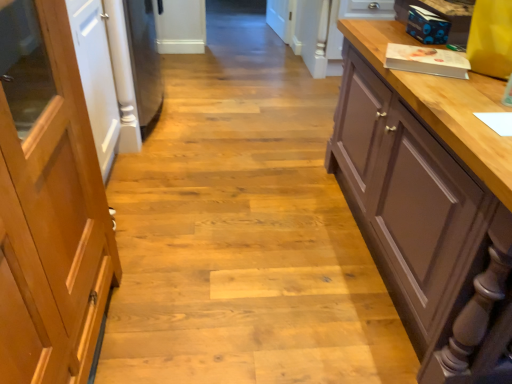
Where is `brown matte cupboard at right`? The height and width of the screenshot is (384, 512). brown matte cupboard at right is located at coordinates (425, 192).

What do you see at coordinates (425, 192) in the screenshot? The image size is (512, 384). I see `brown matte cupboard at right` at bounding box center [425, 192].

What do you see at coordinates (48, 203) in the screenshot? The height and width of the screenshot is (384, 512). I see `light brown wood door at left` at bounding box center [48, 203].

Locate an element on the screen. light brown wood door at left is located at coordinates (48, 203).

Locate an element on the screen. The image size is (512, 384). brown matte cupboard at right is located at coordinates (425, 192).

Based on the photo, is light brown wood door at left at the left side of brown matte cupboard at right?

Correct, you'll find light brown wood door at left to the left of brown matte cupboard at right.

Who is more distant, light brown wood door at left or brown matte cupboard at right?

brown matte cupboard at right is further away from the camera.

Is point (45, 163) more distant than point (454, 259)?

No.

From the picture: From the image's perspective, is light brown wood door at left above brown matte cupboard at right?

Incorrect, from the image's perspective, light brown wood door at left is lower than brown matte cupboard at right.

From a real-world perspective, is light brown wood door at left located beneath brown matte cupboard at right?

No, from a real-world perspective, light brown wood door at left is not beneath brown matte cupboard at right.

Can you confirm if light brown wood door at left is thinner than brown matte cupboard at right?

Yes, light brown wood door at left is thinner than brown matte cupboard at right.

In terms of height, does light brown wood door at left look taller or shorter compared to brown matte cupboard at right?

Considering their sizes, light brown wood door at left has more height than brown matte cupboard at right.

Between light brown wood door at left and brown matte cupboard at right, which one has smaller size?

Smaller between the two is light brown wood door at left.

Which is correct: light brown wood door at left is inside brown matte cupboard at right, or outside of it?

light brown wood door at left is not enclosed by brown matte cupboard at right.

Looking at this image, is light brown wood door at left placed right next to brown matte cupboard at right?

No, light brown wood door at left is not with brown matte cupboard at right.

Is light brown wood door at left facing towards brown matte cupboard at right?

Yes, light brown wood door at left is aimed at brown matte cupboard at right.

At what (x,y) coordinates should I click in order to perform the action: click on cabinetry positioned vertically above the brown matte cupboard at right (from a real-world perspective). Please return your answer as a coordinate pair (x, y). This screenshot has height=384, width=512. Looking at the image, I should click on (48, 203).

Can you confirm if brown matte cupboard at right is positioned to the right of light brown wood door at left?

Yes, brown matte cupboard at right is to the right of light brown wood door at left.

Which object is closer to the camera taking this photo, brown matte cupboard at right or light brown wood door at left?

Positioned in front is light brown wood door at left.

Between point (432, 115) and point (2, 66), which one is positioned behind?

The point (432, 115) is farther from the camera.

From the image's perspective, would you say brown matte cupboard at right is shown under light brown wood door at left?

No, from the image's perspective, brown matte cupboard at right is not beneath light brown wood door at left.

From a real-world perspective, which object rests below the other?

From a 3D spatial view, brown matte cupboard at right is below.

Which object is wider, brown matte cupboard at right or light brown wood door at left?

brown matte cupboard at right is wider.

Between brown matte cupboard at right and light brown wood door at left, which one has less height?

Standing shorter between the two is brown matte cupboard at right.

Who is smaller, brown matte cupboard at right or light brown wood door at left?

light brown wood door at left.

Is brown matte cupboard at right completely or partially outside of light brown wood door at left?

Yes, brown matte cupboard at right is not within light brown wood door at left.

Would you say brown matte cupboard at right is a long distance from light brown wood door at left?

brown matte cupboard at right is far away from light brown wood door at left.

Is brown matte cupboard at right oriented away from light brown wood door at left?

No, brown matte cupboard at right is not facing the opposite direction of light brown wood door at left.

Can you tell me how much brown matte cupboard at right and light brown wood door at left differ in facing direction?

brown matte cupboard at right and light brown wood door at left are facing 90.3 degrees away from each other.

At what (x,y) coordinates should I click in order to perform the action: click on cupboard above the light brown wood door at left (from the image's perspective). Please return your answer as a coordinate pair (x, y). Looking at the image, I should click on click(425, 192).

You are a GUI agent. You are given a task and a screenshot of the screen. Output one action in this format:
    pyautogui.click(x=<x>, y=<y>)
    Task: Click on the cabinetry lying on the left of brown matte cupboard at right
    
    Given the screenshot: What is the action you would take?
    pyautogui.click(x=48, y=203)

This screenshot has width=512, height=384. In order to click on cupboard on the right of light brown wood door at left in this screenshot , I will do `click(425, 192)`.